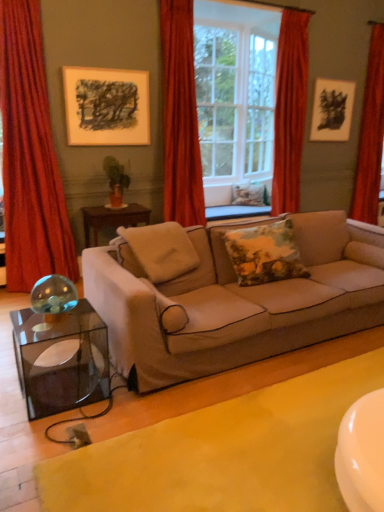
Measure the distance between point [24,41] and camera.

The depth of point [24,41] is 3.61 meters.

The height and width of the screenshot is (512, 384). Describe the element at coordinates (332, 110) in the screenshot. I see `black paper picture frame at upper right, positioned as the 1th picture frame in back-to-front order` at that location.

What is the approximate width of transparent glass table at lower left?

transparent glass table at lower left is 19.00 inches in width.

The width and height of the screenshot is (384, 512). I want to click on transparent glass table at lower left, so (61, 360).

Image resolution: width=384 pixels, height=512 pixels. What do you see at coordinates (234, 301) in the screenshot?
I see `beige fabric couch at center` at bounding box center [234, 301].

Locate an element on the screen. clear glass window at center is located at coordinates (180, 117).

Which of these two, clear glass window at center or velvet red curtain at center, the 2th curtain viewed from the left, is smaller?

velvet red curtain at center, the 2th curtain viewed from the left.

Between point (296, 174) and point (201, 190), which one is positioned in front?

The point (201, 190) is in front.

Is clear glass window at center thinner than velvet red curtain at center, the 2th curtain viewed from the left?

No.

Is clear glass window at center shorter than velvet red curtain at center, the 2th curtain viewed from the left?

Yes.

Considering the relative positions of velvet red curtain at center, the 2th curtain viewed from the left, and beige fabric couch at center in the image provided, is velvet red curtain at center, the 2th curtain viewed from the left, to the left or to the right of beige fabric couch at center?

From the image, it's evident that velvet red curtain at center, the 2th curtain viewed from the left, is to the left of beige fabric couch at center.

How many degrees apart are the facing directions of velvet red curtain at center, the 2th curtain viewed from the left, and beige fabric couch at center?

velvet red curtain at center, the 2th curtain viewed from the left, and beige fabric couch at center are facing 0.585 degrees away from each other.

From the image's perspective, is velvet red curtain at center, positioned as the third curtain in right-to-left order, above or below beige fabric couch at center?

Clearly, from the image's perspective, velvet red curtain at center, positioned as the third curtain in right-to-left order, is above beige fabric couch at center.

Would you say velvet red curtain at center, the 2th curtain viewed from the left, contains beige fabric couch at center?

No, beige fabric couch at center is not surrounded by velvet red curtain at center, the 2th curtain viewed from the left.

Which is closer, (x=173, y=210) or (x=16, y=244)?

Clearly, point (x=173, y=210) is more distant from the camera than point (x=16, y=244).

How many degrees apart are the facing directions of velvet red curtain at center, the 2th curtain viewed from the left, and velvet red curtain at left, the fourth curtain when ordered from right to left?

There is a 0.421-degree angle between the facing directions of velvet red curtain at center, the 2th curtain viewed from the left, and velvet red curtain at left, the fourth curtain when ordered from right to left.

Where is `the 1st curtain to the right of the velvet red curtain at left, positioned as the first curtain in left-to-right order, starting your count from the anchor`? The height and width of the screenshot is (512, 384). the 1st curtain to the right of the velvet red curtain at left, positioned as the first curtain in left-to-right order, starting your count from the anchor is located at coordinates (180, 117).

How distant is fluffy fabric pillow at center, which ranks as the 1th pillow in back-to-front order, from beige fabric couch at center?

fluffy fabric pillow at center, which ranks as the 1th pillow in back-to-front order, and beige fabric couch at center are 9.21 feet apart.

Looking at the image, does fluffy fabric pillow at center, positioned as the first pillow in top-to-bottom order, seem bigger or smaller compared to beige fabric couch at center?

fluffy fabric pillow at center, positioned as the first pillow in top-to-bottom order, is smaller than beige fabric couch at center.

Considering the points (267, 202) and (99, 302), which point is in front, point (267, 202) or point (99, 302)?

The point (99, 302) is more forward.

From a real-world perspective, which is physically below, fluffy fabric pillow at center, which appears as the third pillow when viewed from the front, or beige fabric couch at center?

beige fabric couch at center, from a real-world perspective.

Is red velvet curtain at upper center, the third curtain viewed from the left, placed right next to velvet red curtain at center, the 2th curtain viewed from the left?

No, red velvet curtain at upper center, the third curtain viewed from the left, is not touching velvet red curtain at center, the 2th curtain viewed from the left.

From a real-world perspective, who is located higher, red velvet curtain at upper center, the third curtain viewed from the left, or velvet red curtain at center, positioned as the third curtain in right-to-left order?

red velvet curtain at upper center, the third curtain viewed from the left.

Is red velvet curtain at upper center, the 2th curtain viewed from the right, positioned with its back to velvet red curtain at center, positioned as the third curtain in right-to-left order?

No, red velvet curtain at upper center, the 2th curtain viewed from the right,'s orientation is not away from velvet red curtain at center, positioned as the third curtain in right-to-left order.

This screenshot has width=384, height=512. What are the coordinates of `curtain above the velvet red curtain at center, the 2th curtain viewed from the left (from a real-world perspective)` in the screenshot? It's located at (289, 110).

Is point (131, 93) closer or farther from the camera than point (294, 112)?

Point (131, 93) appears to be closer to the viewer than point (294, 112).

You are a GUI agent. You are given a task and a screenshot of the screen. Output one action in this format:
    pyautogui.click(x=<x>, y=<y>)
    Task: Click on the picture frame on the left of red velvet curtain at upper center, the third curtain viewed from the left
    This screenshot has height=512, width=384.
    Given the screenshot: What is the action you would take?
    click(x=106, y=106)

Could you tell me if matte black picture frame at upper left, which is counted as the 1th picture frame, starting from the front, is turned towards red velvet curtain at upper center, the 2th curtain viewed from the right?

No, matte black picture frame at upper left, which is counted as the 1th picture frame, starting from the front, does not turn towards red velvet curtain at upper center, the 2th curtain viewed from the right.

From the image's perspective, is matte black picture frame at upper left, which is counted as the 1th picture frame, starting from the front, on top of red velvet curtain at upper center, the 2th curtain viewed from the right?

Actually, matte black picture frame at upper left, which is counted as the 1th picture frame, starting from the front, appears below red velvet curtain at upper center, the 2th curtain viewed from the right, in the image.

Is white glass window frame at center to the right of beige fabric pillow at center, the 2th pillow ordered from the bottom, from the viewer's perspective?

Indeed, white glass window frame at center is positioned on the right side of beige fabric pillow at center, the 2th pillow ordered from the bottom.

Is white glass window frame at center inside the boundaries of beige fabric pillow at center, which is the 3th pillow in back-to-front order, or outside?

white glass window frame at center is located beyond the bounds of beige fabric pillow at center, which is the 3th pillow in back-to-front order.

Considering the relative sizes of white glass window frame at center and beige fabric pillow at center, which is counted as the 1th pillow, starting from the front, in the image provided, is white glass window frame at center smaller than beige fabric pillow at center, which is counted as the 1th pillow, starting from the front,?

Yes, white glass window frame at center is smaller than beige fabric pillow at center, which is counted as the 1th pillow, starting from the front.

Can you confirm if white glass window frame at center is shorter than beige fabric pillow at center, which is the second pillow from top to bottom?

No.

Find the location of `window positioned vertically above the velvet red curtain at center, positioned as the third curtain in right-to-left order (from a real-world perspective)`. window positioned vertically above the velvet red curtain at center, positioned as the third curtain in right-to-left order (from a real-world perspective) is located at coordinates (180, 117).

Image resolution: width=384 pixels, height=512 pixels. I want to click on the 2nd curtain above the beige fabric couch at center (from the image's perspective), so click(x=180, y=117).

Estimate the real-world distances between objects in this image. Which object is closer to velvet red curtain at center, the 2th curtain viewed from the left, beige fabric pillow at center, the 2th pillow ordered from the bottom, or red velvet curtain at upper center, the third curtain viewed from the left?

beige fabric pillow at center, the 2th pillow ordered from the bottom.

Looking at the image, which one is located further to fluffy fabric pillow at center, which appears as the third pillow when viewed from the front, green matte plant at center or matte black picture frame at upper left, which is the second picture frame from back to front?

Among the two, matte black picture frame at upper left, which is the second picture frame from back to front, is located further to fluffy fabric pillow at center, which appears as the third pillow when viewed from the front.

Looking at the image, which one is located further to velvet red curtain at right, which is counted as the 4th curtain, starting from the left, velvet red curtain at left, positioned as the first curtain in left-to-right order, or green matte plant at center?

velvet red curtain at left, positioned as the first curtain in left-to-right order.

Estimate the real-world distances between objects in this image. Which object is closer to clear glass window at center, matte black picture frame at upper left, which is the second picture frame from back to front, or fluffy fabric pillow at center, which appears as the third pillow when viewed from the front?

Based on the image, fluffy fabric pillow at center, which appears as the third pillow when viewed from the front, appears to be nearer to clear glass window at center.

Which object lies nearer to the anchor point green matte plant at center, velvet red curtain at center, the 2th curtain viewed from the left, or velvet red curtain at left, the fourth curtain when ordered from right to left?

Among the two, velvet red curtain at left, the fourth curtain when ordered from right to left, is located nearer to green matte plant at center.

When comparing their distances from velvet red curtain at right, which ranks as the first curtain in right-to-left order, does velvet red curtain at left, the fourth curtain when ordered from right to left, or transparent glass table at lower left seem closer?

Among the two, velvet red curtain at left, the fourth curtain when ordered from right to left, is located nearer to velvet red curtain at right, which ranks as the first curtain in right-to-left order.

From the picture: When comparing their distances from beige fabric pillow at center, which is the second pillow from top to bottom, does floral fabric pillow at center, the second pillow in the front-to-back sequence, or black paper picture frame at upper right, which is the 2th picture frame from front to back, seem closer?

floral fabric pillow at center, the second pillow in the front-to-back sequence, is closer to beige fabric pillow at center, which is the second pillow from top to bottom.

Based on the photo, considering their positions, is matte black picture frame at upper left, which is the second picture frame from back to front, positioned closer to velvet red curtain at left, the fourth curtain when ordered from right to left, than floral fabric pillow at center, the 2th pillow viewed from the back?

The object closer to velvet red curtain at left, the fourth curtain when ordered from right to left, is matte black picture frame at upper left, which is the second picture frame from back to front.

Where is `houseplant between transparent glass table at lower left and fluffy fabric pillow at center, which appears as the third pillow when viewed from the front, along the z-axis`? Image resolution: width=384 pixels, height=512 pixels. houseplant between transparent glass table at lower left and fluffy fabric pillow at center, which appears as the third pillow when viewed from the front, along the z-axis is located at coordinates (116, 180).

Locate an element on the screen. The width and height of the screenshot is (384, 512). curtain between velvet red curtain at left, the fourth curtain when ordered from right to left, and white glass window frame at center, in the horizontal direction is located at coordinates (180, 117).

This screenshot has width=384, height=512. What are the coordinates of `window located between green matte plant at center and black paper picture frame at upper right, positioned as the 1th picture frame in back-to-front order, in the left-right direction` in the screenshot? It's located at (180, 117).

You are a GUI agent. You are given a task and a screenshot of the screen. Output one action in this format:
    pyautogui.click(x=<x>, y=<y>)
    Task: Click on the curtain located between velvet red curtain at left, the fourth curtain when ordered from right to left, and clear glass window at center in the left-right direction
    The height and width of the screenshot is (512, 384).
    Given the screenshot: What is the action you would take?
    pyautogui.click(x=180, y=117)